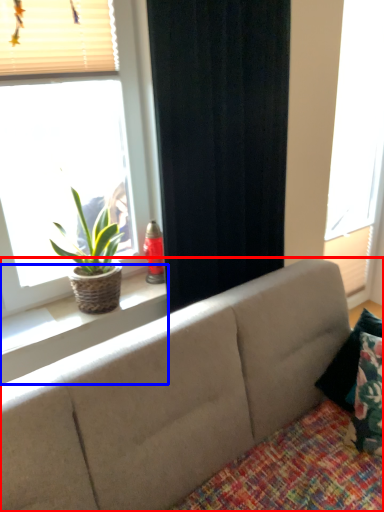
Question: Which of the following is the closest to the observer, studio couch (highlighted by a red box) or window sill (highlighted by a blue box)?

Choices:
 (A) studio couch
 (B) window sill

Answer: (A)